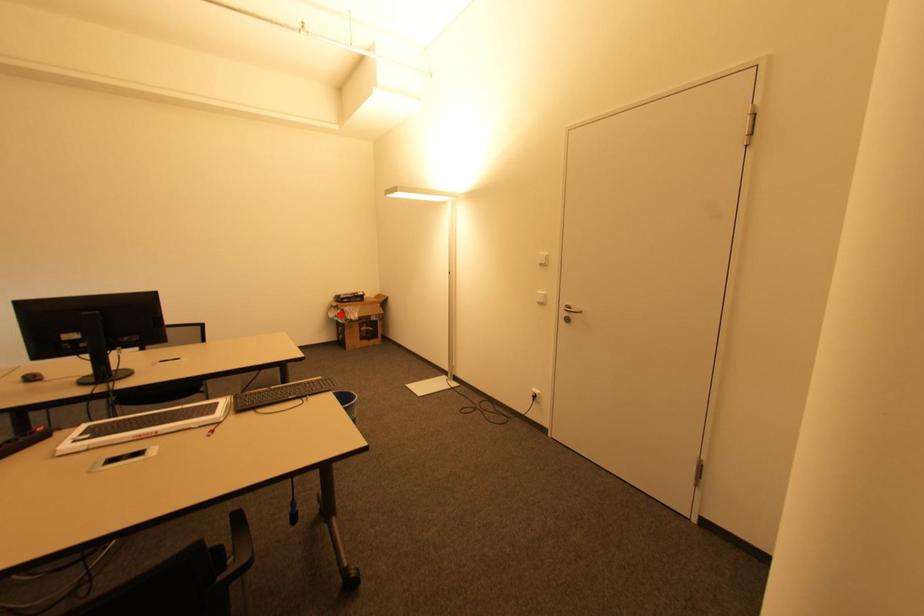
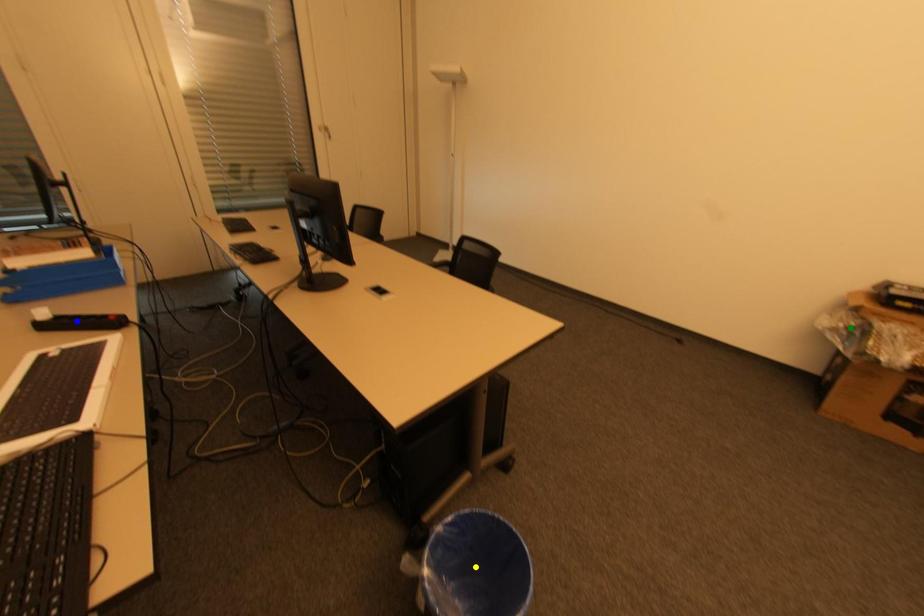
Question: I am providing you with two images of the same scene from different viewpoints. A red point is marked on the first image. You are given multiple points on the second image. Can you choose the point in image 2 that corresponds to the point in image 1?

Choices:
 (A) blue point
 (B) yellow point
 (C) green point

Answer: (C)